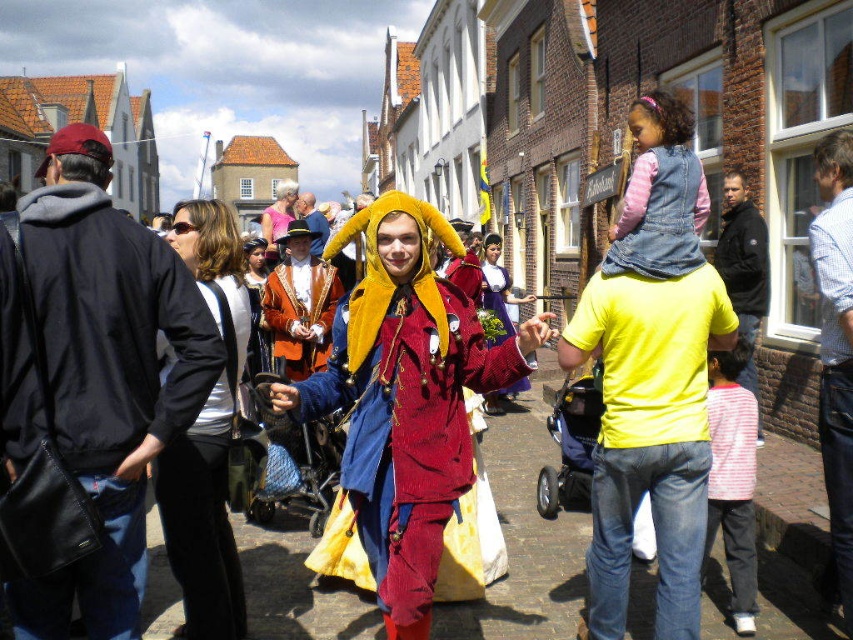
You are standing at the point labeled point (415, 333) and want to walk to the point labeled point (245, 323). Which direction should you face to move towards your destination?

Since point (415, 333) is closer to the camera than point (245, 323), you should face away from the camera to move towards point (245, 323).

You are a costume designer observing the street scene. You need to determine which costume requires more fabric to create between the velvet maroon robe at center and the black leather jacket at center. Which one would need more fabric?

The black leather jacket at center requires more fabric than the velvet maroon robe at center because the velvet maroon robe at center is smaller than the black leather jacket at center.